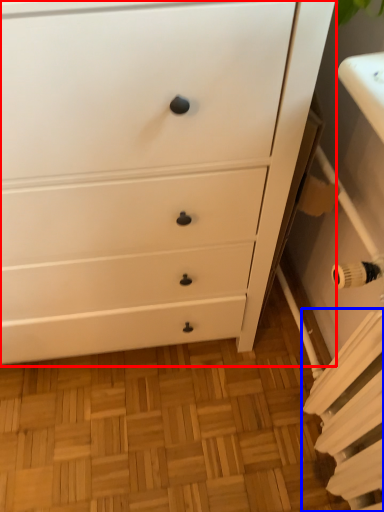
Question: Which object appears closest to the camera in this image, chest of drawers (highlighted by a red box) or radiator (highlighted by a blue box)?

Choices:
 (A) chest of drawers
 (B) radiator

Answer: (A)